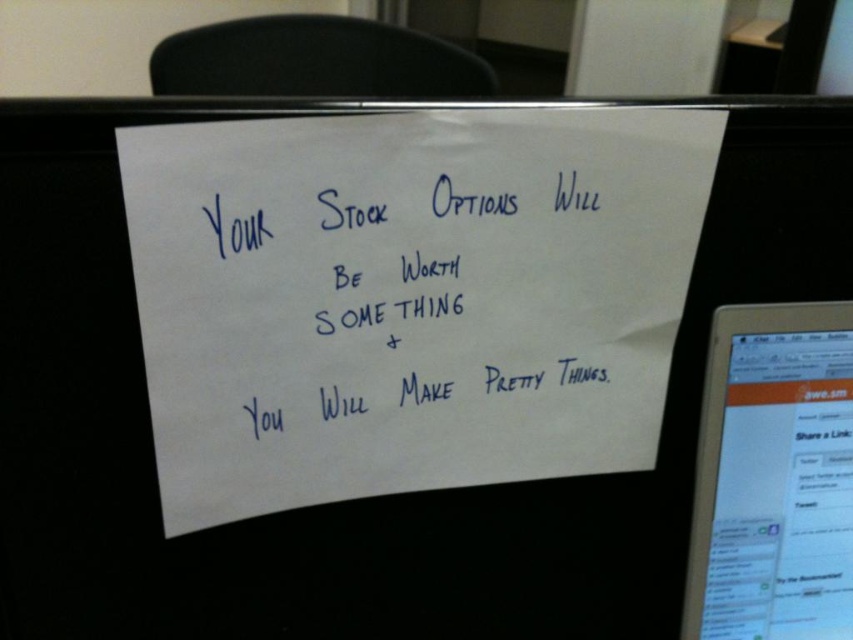
Does blue ink writing at center appear on the left side of white glossy tablet at upper right?

Indeed, blue ink writing at center is positioned on the left side of white glossy tablet at upper right.

Does blue ink writing at center have a smaller size compared to white glossy tablet at upper right?

Incorrect, blue ink writing at center is not smaller in size than white glossy tablet at upper right.

Between point (418, 317) and point (791, 544), which one is positioned in front?

Point (418, 317) is more forward.

You are a GUI agent. You are given a task and a screenshot of the screen. Output one action in this format:
    pyautogui.click(x=<x>, y=<y>)
    Task: Click on the blue ink writing at center
    The width and height of the screenshot is (853, 640).
    Given the screenshot: What is the action you would take?
    pyautogui.click(x=407, y=301)

Is the position of white paper at center more distant than that of blue ink writing at center?

That is False.

Between white paper at center and blue ink writing at center, which one is positioned higher?

blue ink writing at center is higher up.

Find the location of a particular element. The width and height of the screenshot is (853, 640). white paper at center is located at coordinates (407, 298).

Can you confirm if white paper at center is bigger than white glossy tablet at upper right?

Correct, white paper at center is larger in size than white glossy tablet at upper right.

Does white paper at center appear under white glossy tablet at upper right?

Incorrect, white paper at center is not positioned below white glossy tablet at upper right.

Between point (339, 422) and point (851, 625), which one is positioned in front?

Point (339, 422)

This screenshot has height=640, width=853. Find the location of `white paper at center`. white paper at center is located at coordinates (407, 298).